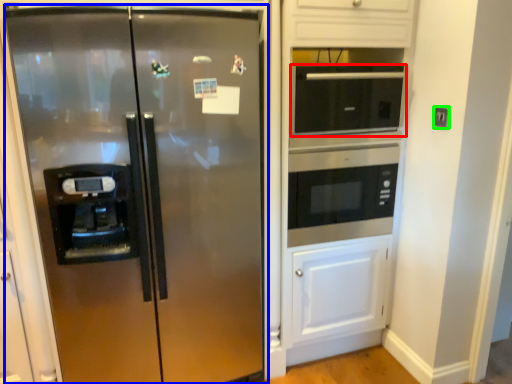
Question: Considering the real-world distances, which object is farthest from microwave oven (highlighted by a red box)? refrigerator (highlighted by a blue box) or electric outlet (highlighted by a green box)?

Choices:
 (A) refrigerator
 (B) electric outlet

Answer: (A)